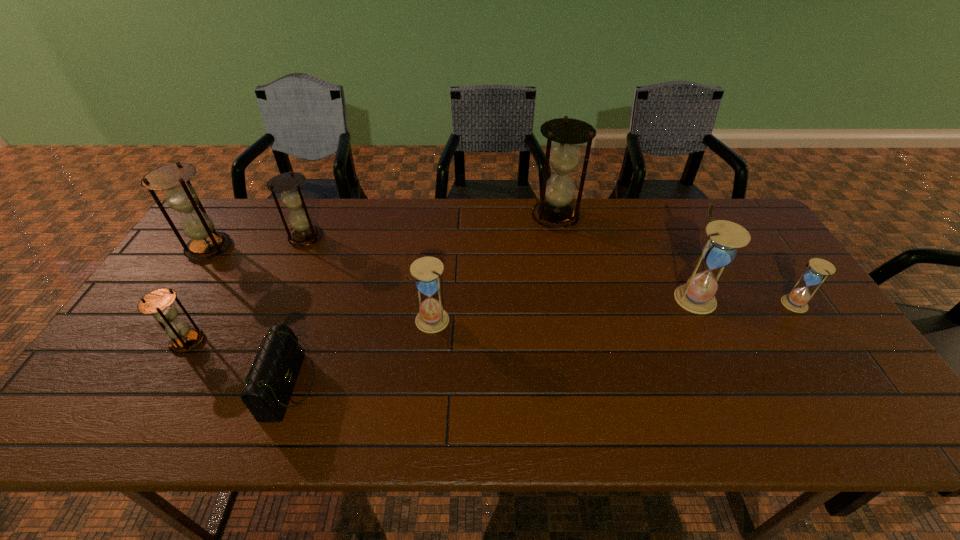
Image resolution: width=960 pixels, height=540 pixels. Find the location of `vacant space that is in between the nearest brown hourglass and the tallest hourglass`. vacant space that is in between the nearest brown hourglass and the tallest hourglass is located at coordinates (372, 279).

Find the location of a particular element. Image resolution: width=960 pixels, height=540 pixels. empty space that is in between the second biggest brown hourglass and the rightmost hourglass is located at coordinates (500, 276).

Identify the location of vacant region between the rightmost object and the fourth hourglass from left to right. (612, 312).

Identify the location of free space between the second brown hourglass from right to left and the shortest object. (298, 312).

The width and height of the screenshot is (960, 540). What are the coordinates of `empty space between the smallest brown hourglass and the rightmost white hourglass` in the screenshot? It's located at (490, 323).

I want to click on vacant region between the third smallest brown hourglass and the tallest hourglass, so click(382, 233).

Identify the location of vacant area between the second smallest white hourglass and the fifth hourglass from right to left. This screenshot has width=960, height=540. (369, 279).

The image size is (960, 540). Find the location of `vacant space that is in between the rightmost white hourglass and the second brown hourglass from right to left`. vacant space that is in between the rightmost white hourglass and the second brown hourglass from right to left is located at coordinates (549, 271).

You are a GUI agent. You are given a task and a screenshot of the screen. Output one action in this format:
    pyautogui.click(x=<x>, y=<y>)
    Task: Click on the sixth closest object to the second smallest brown hourglass
    
    Given the screenshot: What is the action you would take?
    pyautogui.click(x=698, y=294)

Find the location of a particular element. The image size is (960, 540). the sixth closest object to the third object from right to left is located at coordinates (206, 242).